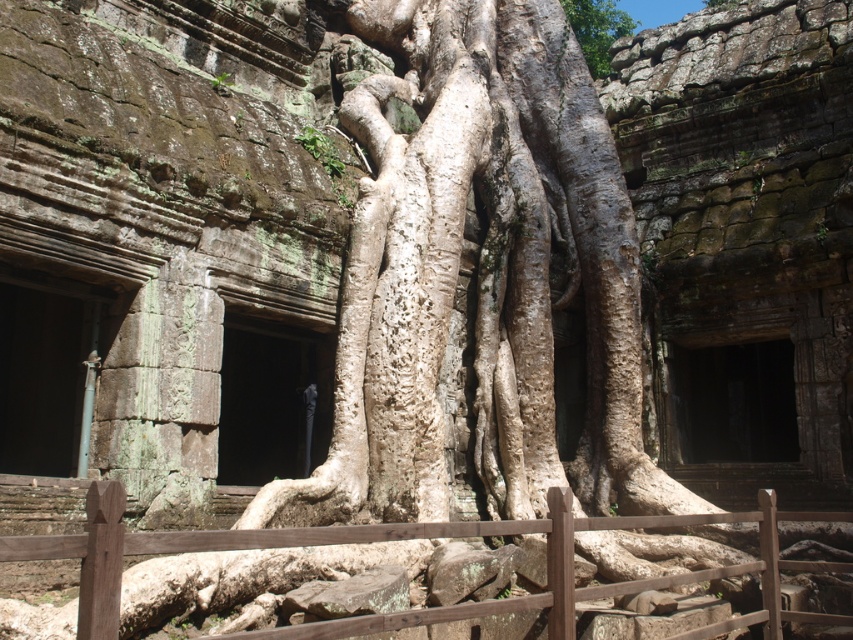
Between point (834, 570) and point (590, 65), which one is positioned behind?

Point (590, 65)

Does brown wooden fence at center come behind white bark tree at upper center?

No, brown wooden fence at center is in front of white bark tree at upper center.

Find the location of a particular element. Image resolution: width=853 pixels, height=640 pixels. brown wooden fence at center is located at coordinates (384, 540).

Where is `brown wooden fence at center`? The width and height of the screenshot is (853, 640). brown wooden fence at center is located at coordinates (384, 540).